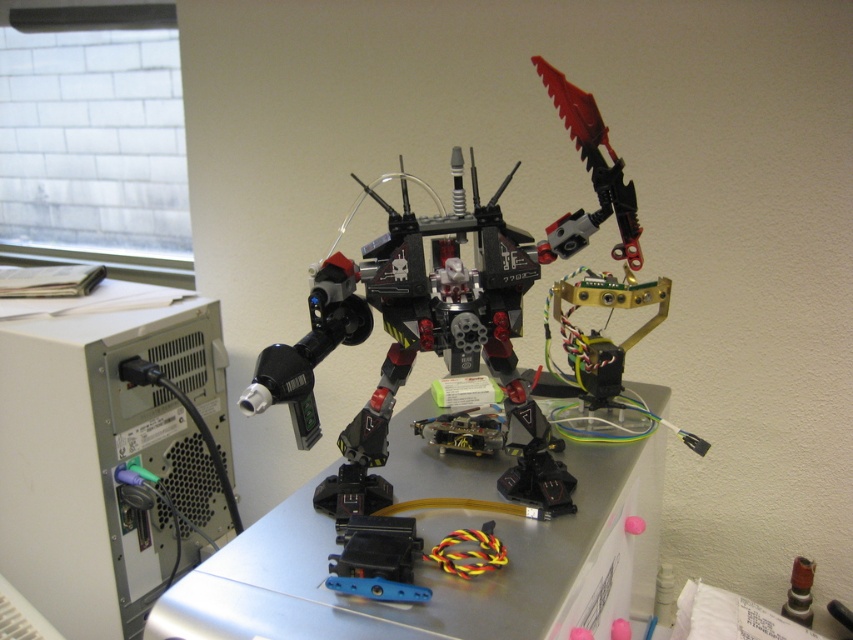
Question: Is black plastic computer at left behind metallic gray table at center?

Choices:
 (A) no
 (B) yes

Answer: (B)

Question: In this image, where is black plastic computer at left located relative to black plastic robot at center?

Choices:
 (A) left
 (B) right

Answer: (A)

Question: Which of the following is the closest to the observer?

Choices:
 (A) (489, 330)
 (B) (106, 372)
 (C) (585, 536)

Answer: (A)

Question: Does black plastic computer at left have a greater width compared to metallic gray table at center?

Choices:
 (A) yes
 (B) no

Answer: (B)

Question: Among these objects, which one is farthest from the camera?

Choices:
 (A) black plastic computer at left
 (B) black plastic robot at center

Answer: (A)

Question: Which point is closer to the camera taking this photo?

Choices:
 (A) (154, 339)
 (B) (589, 528)

Answer: (B)